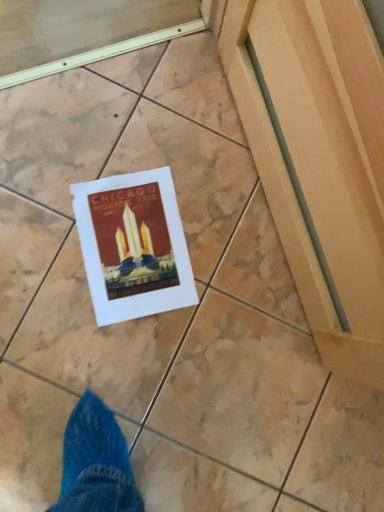
Where is `blank area beneath matte paper postcard at center (from a real-world perspective)`? blank area beneath matte paper postcard at center (from a real-world perspective) is located at coordinates (132, 245).